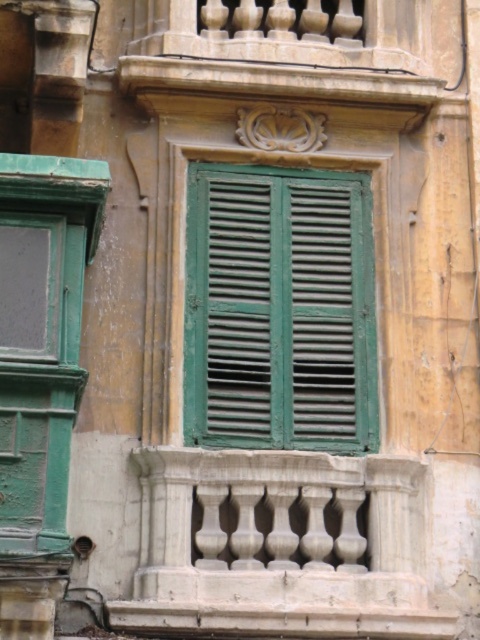
Question: Is green matte shutters at center below green matte door at left?

Choices:
 (A) yes
 (B) no

Answer: (B)

Question: Can you confirm if green matte shutters at center is bigger than green matte door at left?

Choices:
 (A) yes
 (B) no

Answer: (A)

Question: Among these points, which one is nearest to the camera?

Choices:
 (A) (29, 452)
 (B) (208, 172)

Answer: (A)

Question: Which object appears farthest from the camera in this image?

Choices:
 (A) green matte door at left
 (B) green matte shutters at center

Answer: (B)

Question: Is green matte shutters at center above green matte door at left?

Choices:
 (A) yes
 (B) no

Answer: (A)